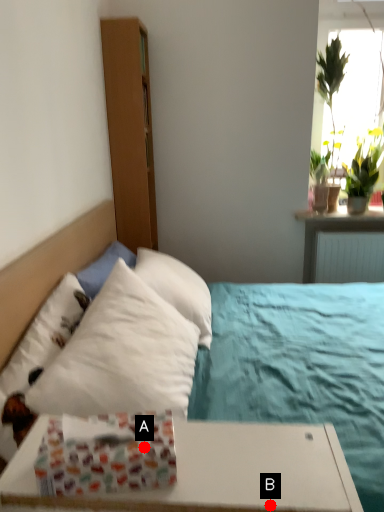
Question: Two points are circled on the image, labeled by A and B beside each circle. Which point is farther to the camera?

Choices:
 (A) A is further
 (B) B is further

Answer: (A)